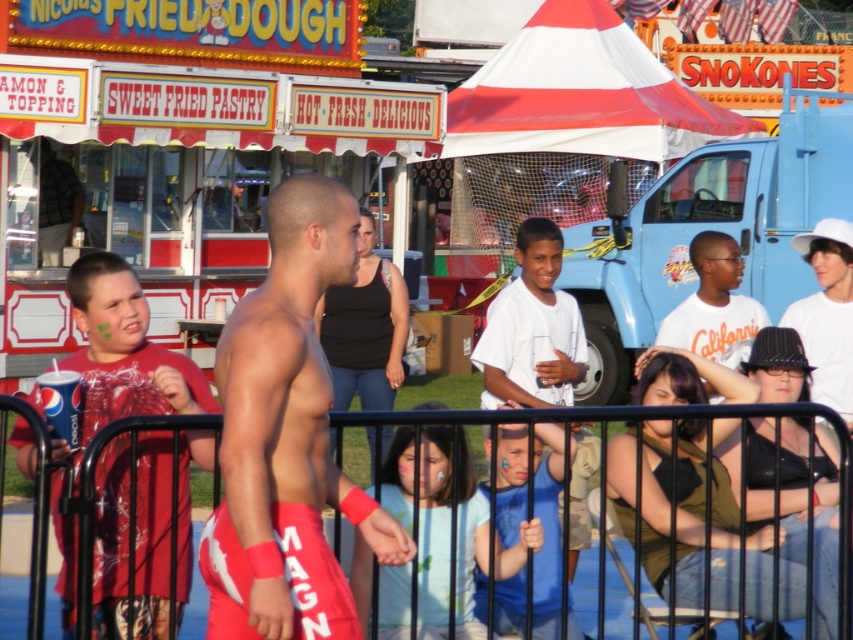
Is white cardboard food truck at upper left smaller than matte red shirt at left?

No, white cardboard food truck at upper left is not smaller than matte red shirt at left.

Is point (198, 61) closer to viewer compared to point (161, 596)?

No, (198, 61) is behind (161, 596).

The height and width of the screenshot is (640, 853). Find the location of `white cardboard food truck at upper left`. white cardboard food truck at upper left is located at coordinates (175, 145).

Is white cardboard food truck at upper left bigger than white cotton t-shirt at upper right?

Correct, white cardboard food truck at upper left is larger in size than white cotton t-shirt at upper right.

Who is positioned more to the right, white cardboard food truck at upper left or white cotton t-shirt at upper right?

Positioned to the right is white cotton t-shirt at upper right.

Describe the element at coordinates (175, 145) in the screenshot. Image resolution: width=853 pixels, height=640 pixels. I see `white cardboard food truck at upper left` at that location.

In order to click on white cardboard food truck at upper left in this screenshot , I will do `click(175, 145)`.

Does red fabric shorts at center appear under white matte shirt at center?

Yes, red fabric shorts at center is below white matte shirt at center.

Does red fabric shorts at center come in front of white matte shirt at center?

Yes.

The height and width of the screenshot is (640, 853). What are the coordinates of `red fabric shorts at center` in the screenshot? It's located at (286, 438).

The image size is (853, 640). In order to click on red fabric shorts at center in this screenshot , I will do `click(286, 438)`.